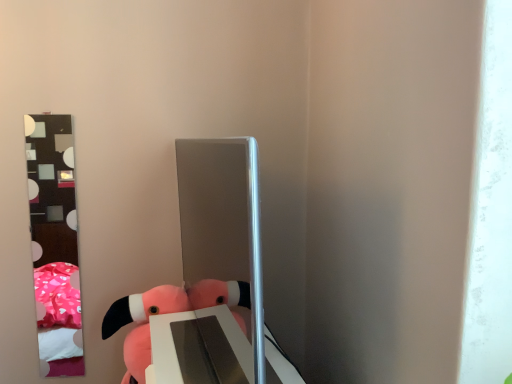
Describe the element at coordinates (223, 221) in the screenshot. This screenshot has width=512, height=384. I see `satin silver mirror at center` at that location.

What do you see at coordinates (54, 243) in the screenshot? The width and height of the screenshot is (512, 384). I see `metallic reflective mirror at left` at bounding box center [54, 243].

At what (x,y) coordinates should I click in order to perform the action: click on satin silver mirror at center. Please return your answer as a coordinate pair (x, y). The image size is (512, 384). Looking at the image, I should click on (223, 221).

Who is taller, metallic reflective mirror at left or pink plush toy at lower left?

metallic reflective mirror at left.

Is pink plush toy at lower left located within metallic reflective mirror at left?

No, pink plush toy at lower left is not inside metallic reflective mirror at left.

From the image's perspective, between metallic reflective mirror at left and pink plush toy at lower left, who is located below?

From the image's view, pink plush toy at lower left is below.

This screenshot has width=512, height=384. What are the coordinates of `mirror that appears above the pink plush toy at lower left (from a real-world perspective)` in the screenshot? It's located at (54, 243).

Between pink plush toy at lower left and metallic reflective mirror at left, which one is positioned in front?

pink plush toy at lower left is in front.

Which is closer to the camera, (214, 305) or (65, 193)?

Point (214, 305) is closer to the camera than point (65, 193).

Is pink plush toy at lower left wider or thinner than metallic reflective mirror at left?

In the image, pink plush toy at lower left appears to be wider than metallic reflective mirror at left.

From the image's perspective, does pink plush toy at lower left appear higher than metallic reflective mirror at left?

Incorrect, from the image's perspective, pink plush toy at lower left is lower than metallic reflective mirror at left.

From the image's perspective, does satin silver mirror at center appear higher than pink plush toy at lower left?

Yes, from the image's perspective, satin silver mirror at center is over pink plush toy at lower left.

Who is smaller, satin silver mirror at center or pink plush toy at lower left?

With smaller size is pink plush toy at lower left.

Is satin silver mirror at center facing away from pink plush toy at lower left?

No, satin silver mirror at center is not facing away from pink plush toy at lower left.

Looking at this image, how much distance is there between metallic reflective mirror at left and satin silver mirror at center?

metallic reflective mirror at left and satin silver mirror at center are 4.33 feet apart.

At what (x,y) coordinates should I click in order to perform the action: click on mirror behind the satin silver mirror at center. Please return your answer as a coordinate pair (x, y). The height and width of the screenshot is (384, 512). Looking at the image, I should click on (54, 243).

From a real-world perspective, is metallic reflective mirror at left under satin silver mirror at center?

Indeed, from a real-world perspective, metallic reflective mirror at left is positioned beneath satin silver mirror at center.

From the image's perspective, which one is positioned higher, pink plush toy at lower left or satin silver mirror at center?

From the image's view, satin silver mirror at center is above.

Are pink plush toy at lower left and satin silver mirror at center making contact?

No, pink plush toy at lower left is not next to satin silver mirror at center.

From a real-world perspective, who is located higher, pink plush toy at lower left or satin silver mirror at center?

In real-world perspective, satin silver mirror at center is above.

Can you tell me how much pink plush toy at lower left and satin silver mirror at center differ in facing direction?

pink plush toy at lower left and satin silver mirror at center are facing 6.63 degrees away from each other.

Is satin silver mirror at center to the left or to the right of metallic reflective mirror at left in the image?

Clearly, satin silver mirror at center is on the right of metallic reflective mirror at left in the image.

From the image's perspective, between satin silver mirror at center and metallic reflective mirror at left, which one is located above?

satin silver mirror at center, from the image's perspective.

Is satin silver mirror at center beside metallic reflective mirror at left?

No, satin silver mirror at center is not next to metallic reflective mirror at left.

Where is `toy below the metallic reflective mirror at left (from the image's perspective)`? toy below the metallic reflective mirror at left (from the image's perspective) is located at coordinates (164, 313).

You are a GUI agent. You are given a task and a screenshot of the screen. Output one action in this format:
    pyautogui.click(x=<x>, y=<y>)
    Task: Click on the toy on the right of metallic reflective mirror at left
    The width and height of the screenshot is (512, 384).
    Given the screenshot: What is the action you would take?
    pyautogui.click(x=164, y=313)

Looking at the image, which one is located closer to satin silver mirror at center, pink plush toy at lower left or metallic reflective mirror at left?

The object closer to satin silver mirror at center is pink plush toy at lower left.

Which object lies further to the anchor point metallic reflective mirror at left, pink plush toy at lower left or satin silver mirror at center?

satin silver mirror at center lies further to metallic reflective mirror at left than the other object.

Which object lies further to the anchor point satin silver mirror at center, metallic reflective mirror at left or pink plush toy at lower left?

metallic reflective mirror at left is positioned further to the anchor satin silver mirror at center.

From the picture: When comparing their distances from metallic reflective mirror at left, does satin silver mirror at center or pink plush toy at lower left seem further?

satin silver mirror at center lies further to metallic reflective mirror at left than the other object.

Considering their positions, is metallic reflective mirror at left positioned closer to pink plush toy at lower left than satin silver mirror at center?

satin silver mirror at center is closer to pink plush toy at lower left.

Which object lies nearer to the anchor point pink plush toy at lower left, satin silver mirror at center or metallic reflective mirror at left?

satin silver mirror at center is positioned closer to the anchor pink plush toy at lower left.

This screenshot has width=512, height=384. I want to click on toy located between satin silver mirror at center and metallic reflective mirror at left in the depth direction, so click(x=164, y=313).